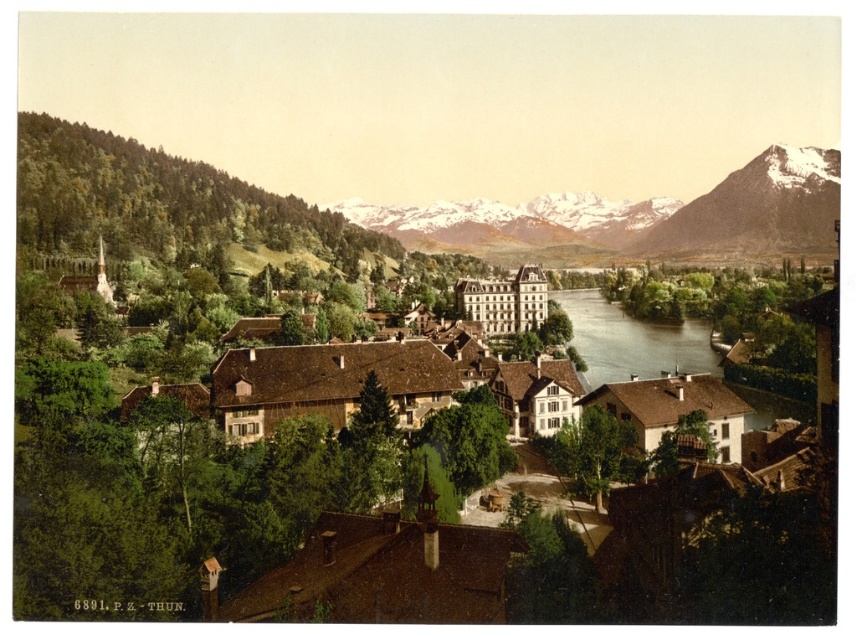
Can you confirm if snowy granite mountain at upper right is positioned to the left of brown water at center?

In fact, snowy granite mountain at upper right is to the right of brown water at center.

Is point (712, 188) closer to camera compared to point (612, 340)?

No, it is not.

Locate an element on the screen. snowy granite mountain at upper right is located at coordinates (757, 209).

Between point (492, 216) and point (682, 342), which one is positioned behind?

The point (492, 216) is more distant.

Is snowy granite mountain at upper center taller than brown water at center?

Yes, snowy granite mountain at upper center is taller than brown water at center.

Is point (648, 216) in front of point (586, 323)?

No, (648, 216) is further to viewer.

The width and height of the screenshot is (857, 640). In order to click on snowy granite mountain at upper center in this screenshot , I will do `click(638, 218)`.

From the picture: Who is positioned more to the left, snowy granite mountain at upper center or snowy granite mountain at upper right?

Positioned to the left is snowy granite mountain at upper center.

Who is lower down, snowy granite mountain at upper center or snowy granite mountain at upper right?

Positioned lower is snowy granite mountain at upper right.

The height and width of the screenshot is (640, 857). What are the coordinates of `snowy granite mountain at upper center` in the screenshot? It's located at (638, 218).

The image size is (857, 640). In order to click on snowy granite mountain at upper center in this screenshot , I will do `click(638, 218)`.